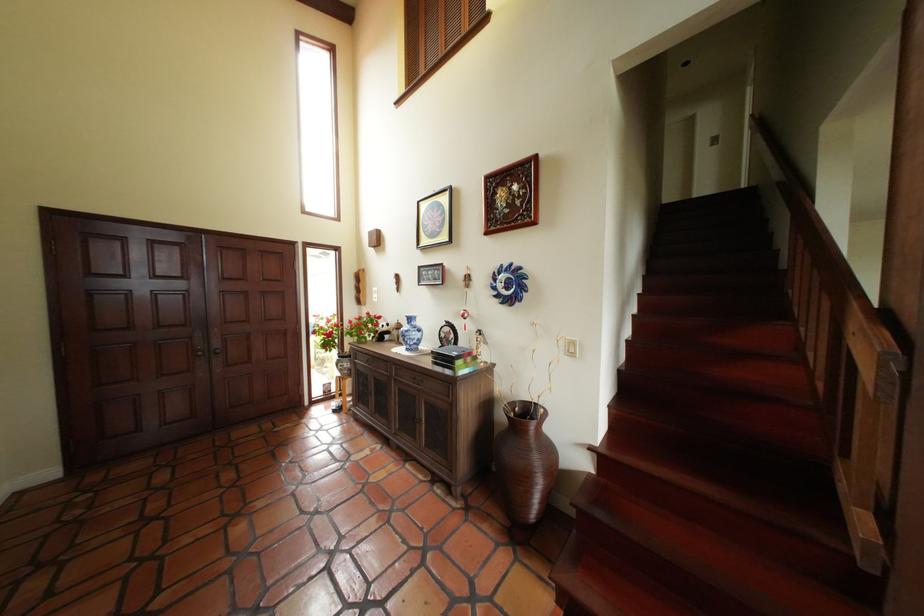
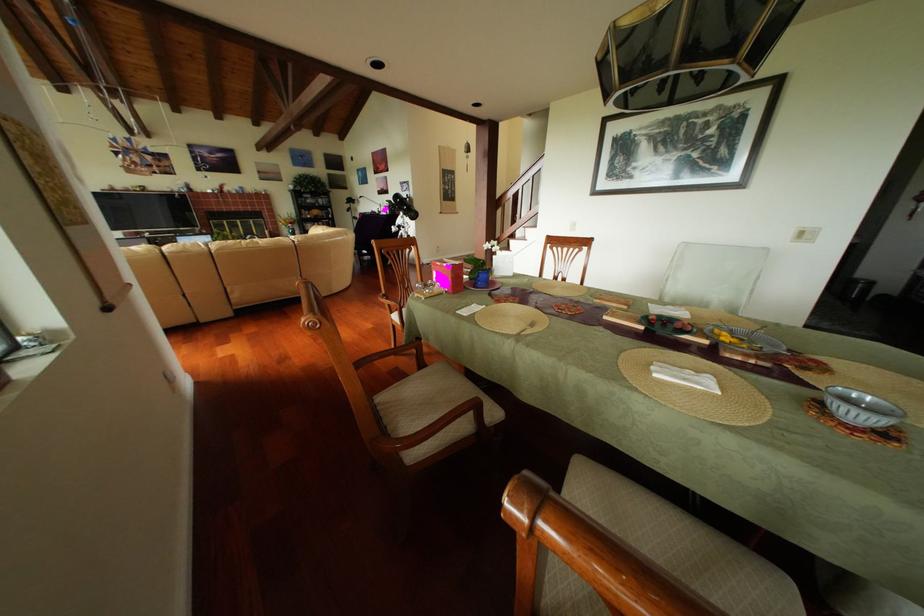
Question: I am providing you with two images of the same scene from different viewpoints. Please identify which objects are invisible in image2.

Choices:
 (A) cabinet drawer knob
 (B) metal fork
 (C) wooden book stand
 (D) chair sitting surface

Answer: (A)